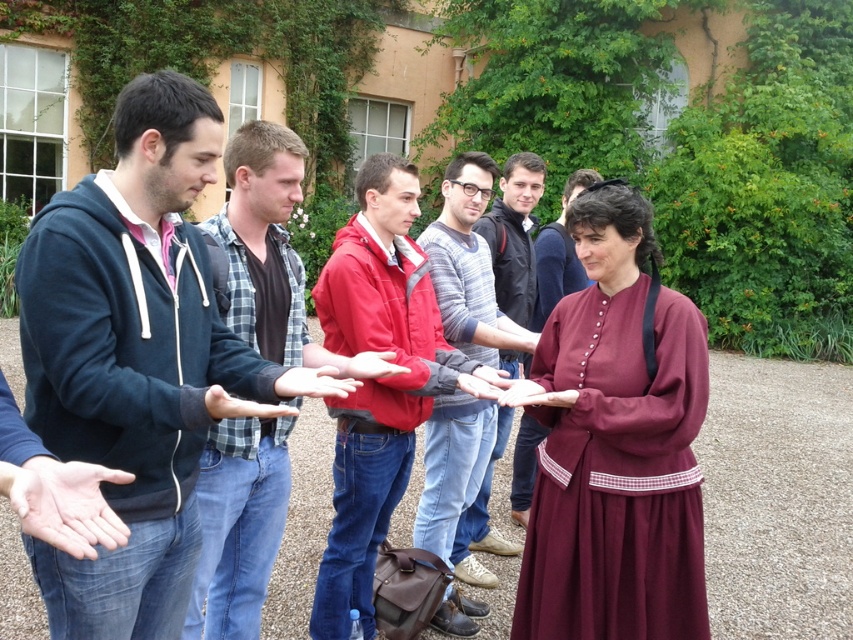
Between red jacket at center and pink flesh at center, which one has less height?

pink flesh at center is shorter.

I want to click on red jacket at center, so click(379, 381).

Identify the location of red jacket at center. The width and height of the screenshot is (853, 640). (379, 381).

Does burgundy cotton dress at center have a smaller size compared to red jacket at center?

Yes, burgundy cotton dress at center is smaller than red jacket at center.

Between burgundy cotton dress at center and red jacket at center, which one appears on the right side from the viewer's perspective?

From the viewer's perspective, burgundy cotton dress at center appears more on the right side.

Which is in front, point (553, 573) or point (364, 547)?

Point (553, 573) is in front.

This screenshot has height=640, width=853. Find the location of `burgundy cotton dress at center`. burgundy cotton dress at center is located at coordinates (616, 445).

Does matte red dress at center appear on the left side of matte brown leather hand at center?

Incorrect, matte red dress at center is not on the left side of matte brown leather hand at center.

Which is more to the right, matte red dress at center or matte brown leather hand at center?

Positioned to the right is matte red dress at center.

Which is in front, point (512, 509) or point (529, 388)?

Point (529, 388) is in front.

This screenshot has height=640, width=853. What are the coordinates of `matte red dress at center` in the screenshot? It's located at (558, 253).